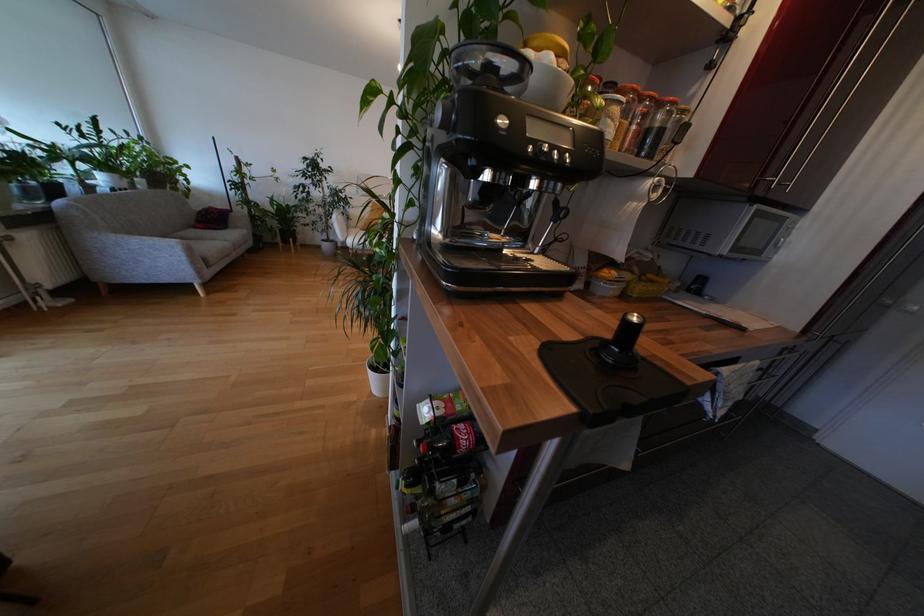
Where would you grasp the apple juice carton? Please return your answer as a coordinate pair (x, y).

(442, 407)